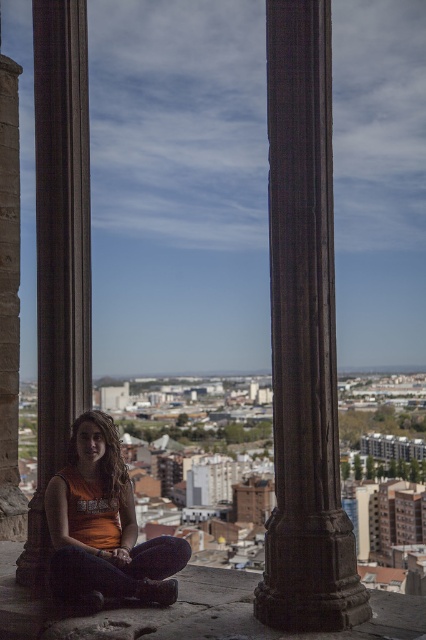
You are standing at the base of the brown stone pillar at left and want to hand a scarf to the person sitting on the orange fabric at center. In which direction should you move to reach them?

The orange fabric at center is to the right of the brown stone pillar at left, so you should move to your right to reach the person sitting on the orange fabric at center.

You are standing at the point marked by the coordinates (304, 337) in the image. What object are you directly in front of?

The point (304, 337) corresponds to the dark stone column at center, so you are directly in front of the dark stone column at center.

You are an architect designing a new structure that needs to align with the existing columns. Given that the dark stone column at center and the brown stone pillar at left are part of the historical site, which column should you consider as the wider one for structural compatibility?

The brown stone pillar at left is wider than the dark stone column at center, so you should consider the brown stone pillar at left as the wider one for structural compatibility.